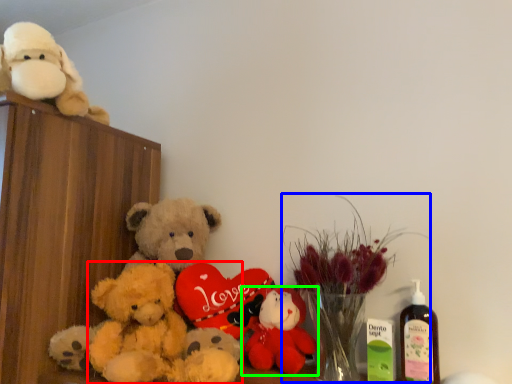
Question: Which object is positioned closest to teddy bear (highlighted by a red box)? Select from floral arrangement (highlighted by a blue box) and toy (highlighted by a green box).

Choices:
 (A) floral arrangement
 (B) toy

Answer: (B)